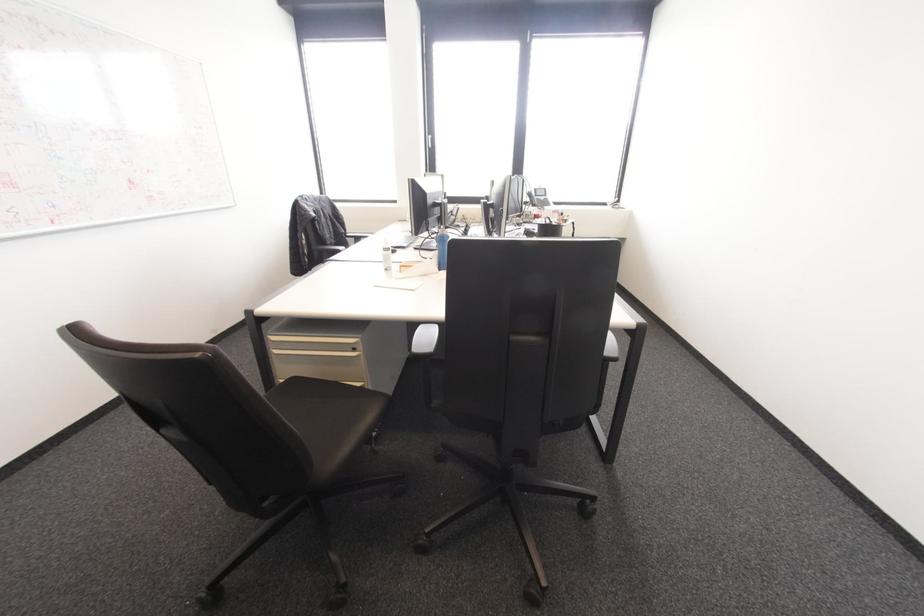
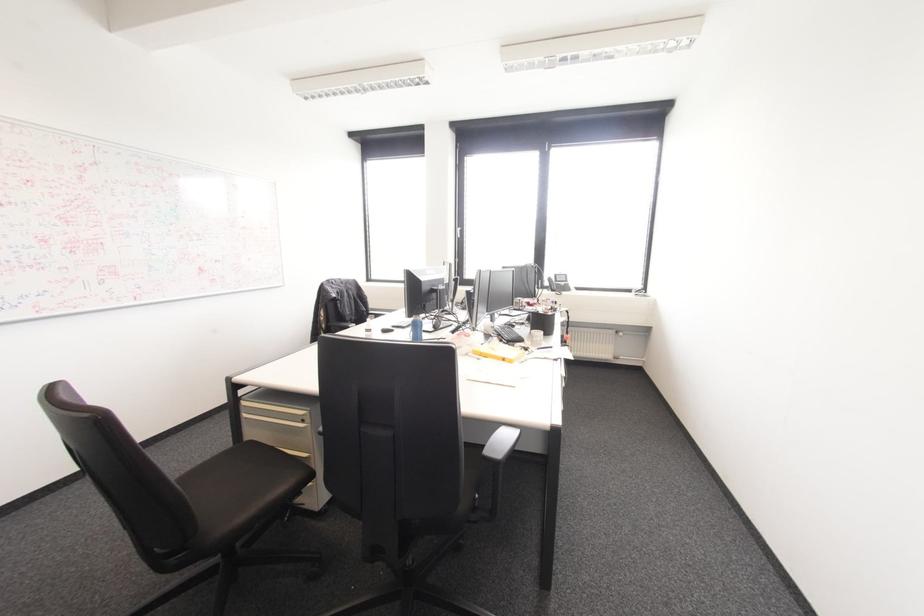
Question: The camera is either moving clockwise (left) or counter-clockwise (right) around the object. The first image is from the beginning of the video and the second image is from the end. Is the camera moving left or right when shooting the video?

Choices:
 (A) Left
 (B) Right

Answer: (B)